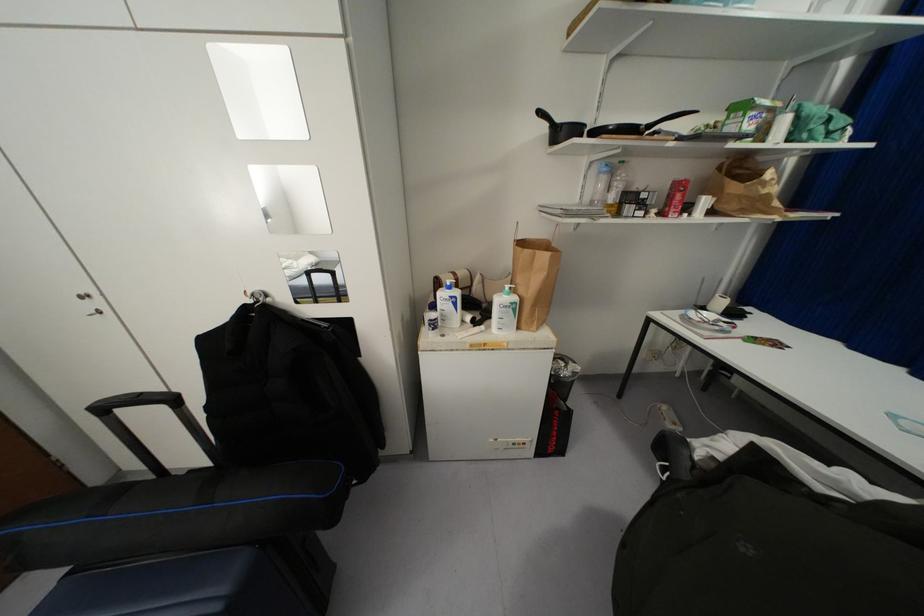
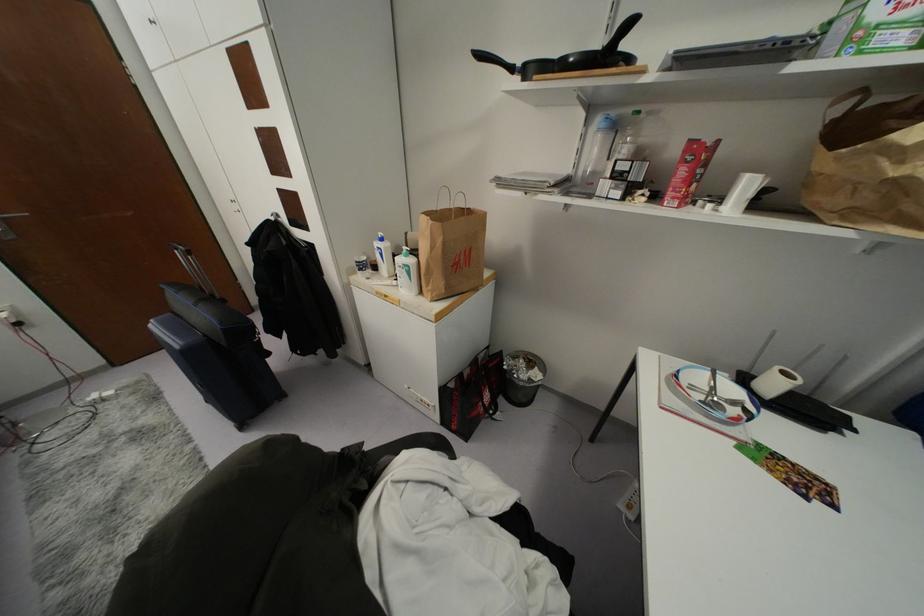
Locate, in the second image, the point that corresponds to pixel 515 298 in the first image.

(410, 261)